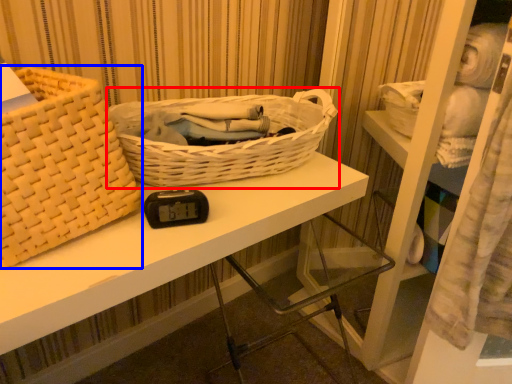
Question: Which object appears farthest to the camera in this image, picnic basket (highlighted by a red box) or picnic basket (highlighted by a blue box)?

Choices:
 (A) picnic basket
 (B) picnic basket

Answer: (A)